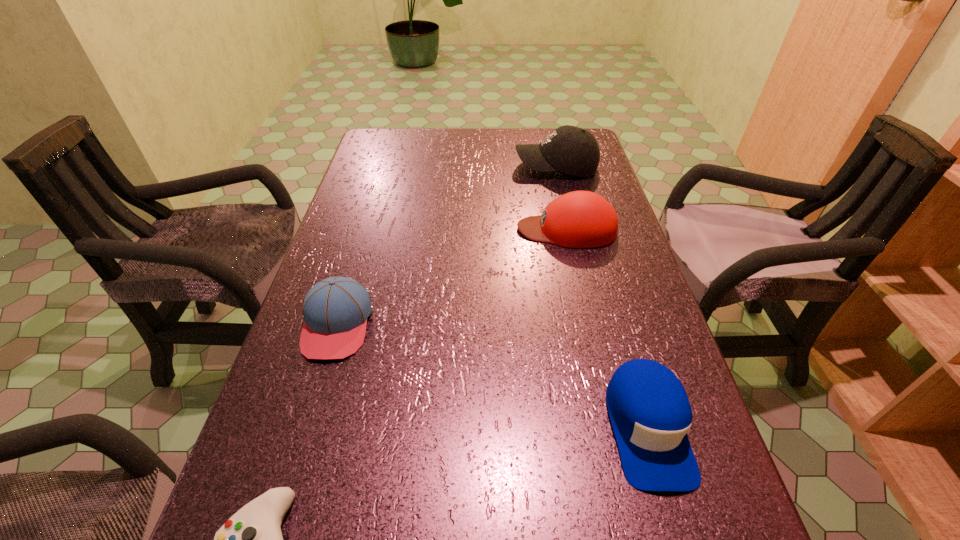
Image resolution: width=960 pixels, height=540 pixels. Identify the location of vacant area that lies between the second farthest object and the nearest baseball cap. (607, 328).

At what (x,y) coordinates should I click in order to perform the action: click on vacant area that lies between the leftmost baseball cap and the tallest object. Please return your answer as a coordinate pair (x, y). Looking at the image, I should click on (446, 246).

Locate an element on the screen. This screenshot has width=960, height=540. vacant space that's between the leftmost baseball cap and the nearest baseball cap is located at coordinates (492, 376).

The height and width of the screenshot is (540, 960). Find the location of `free spot between the farthest baseball cap and the nearest baseball cap`. free spot between the farthest baseball cap and the nearest baseball cap is located at coordinates (601, 297).

Locate an element on the screen. This screenshot has height=540, width=960. vacant space that's between the leftmost baseball cap and the farthest object is located at coordinates (446, 246).

Locate which object is the second closest to the second farthest object. Please provide its 2D coordinates. Your answer should be formatted as a tuple, i.e. [(x, y)], where the tuple contains the x and y coordinates of a point satisfying the conditions above.

[(335, 310)]

Where is `the closest object to the control`? This screenshot has height=540, width=960. the closest object to the control is located at coordinates (335, 310).

Identify which baseball cap is located as the second nearest to the tallest baseball cap. Please provide its 2D coordinates. Your answer should be formatted as a tuple, i.e. [(x, y)], where the tuple contains the x and y coordinates of a point satisfying the conditions above.

[(335, 310)]

Identify which baseball cap is the second nearest to the tallest object. Please provide its 2D coordinates. Your answer should be formatted as a tuple, i.e. [(x, y)], where the tuple contains the x and y coordinates of a point satisfying the conditions above.

[(335, 310)]

Where is `free space that satisfies the following two spatial constraints: 1. on the front-facing side of the fourth nearest object; 2. on the front-facing side of the second nearest baseball cap`? This screenshot has width=960, height=540. free space that satisfies the following two spatial constraints: 1. on the front-facing side of the fourth nearest object; 2. on the front-facing side of the second nearest baseball cap is located at coordinates (588, 325).